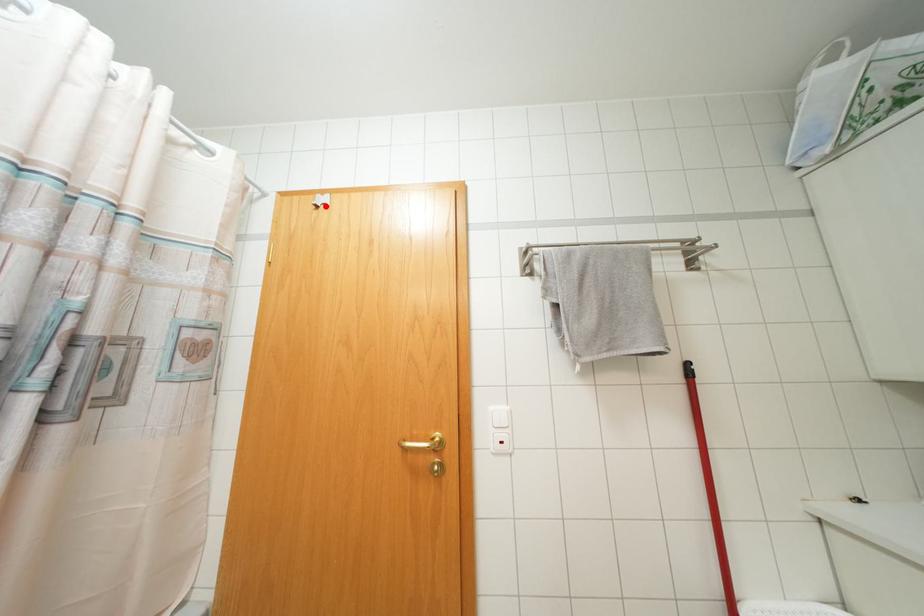
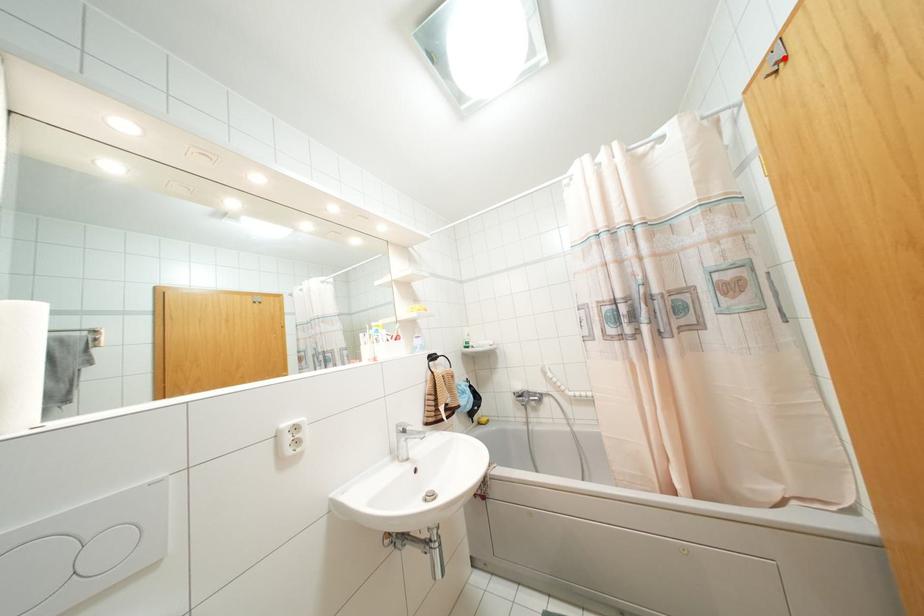
I am providing you with two images of the same scene from different viewpoints. A red point is marked on the first image and another point is marked on the second image. Is the red point in image1 aligned with the point shown in image2?

Yes